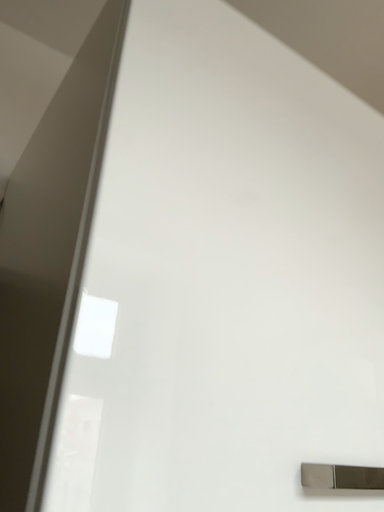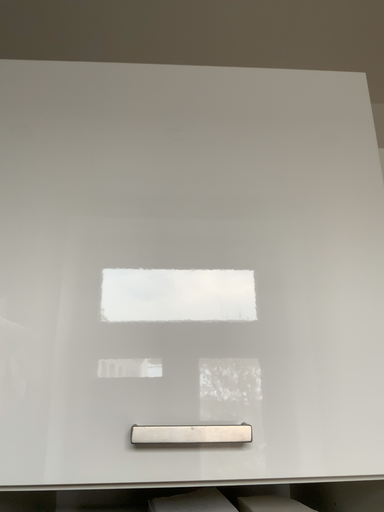
Question: How did the camera likely rotate when shooting the video?

Choices:
 (A) rotated downward
 (B) rotated upward

Answer: (A)